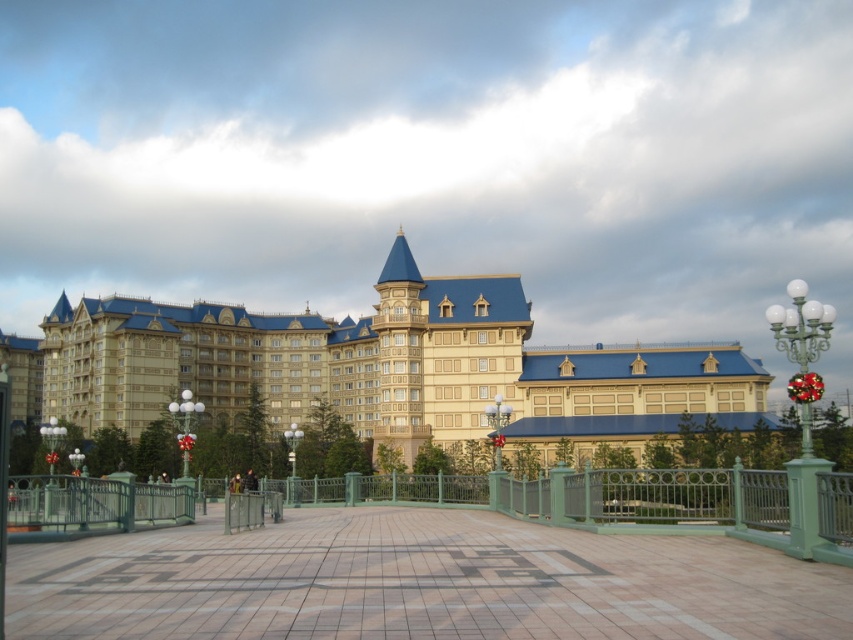
You are standing at the entrance of the grand building and notice two points marked on the walkway in front of you. The first point is at coordinates point (277, 556) and the second is at point (506, 481). Which point is closer to your current position?

Point (277, 556) is closer to the camera than point (506, 481), so the first point is closer to your current position.

You are standing at the entrance of the building and want to walk along the pebble stone walkway at center towards the green metal fence at center. Which direction should you face to walk towards the fence?

You should face to the right to walk towards the green metal fence at center because the pebble stone walkway at center is to the left of the green metal fence at center.

You are an architect visiting the grand building. You notice the matte gold palace at center and the green metal fence at center. Which object would you say occupies more space in the image?

The matte gold palace at center is larger in size than the green metal fence at center, so it occupies more space in the image.